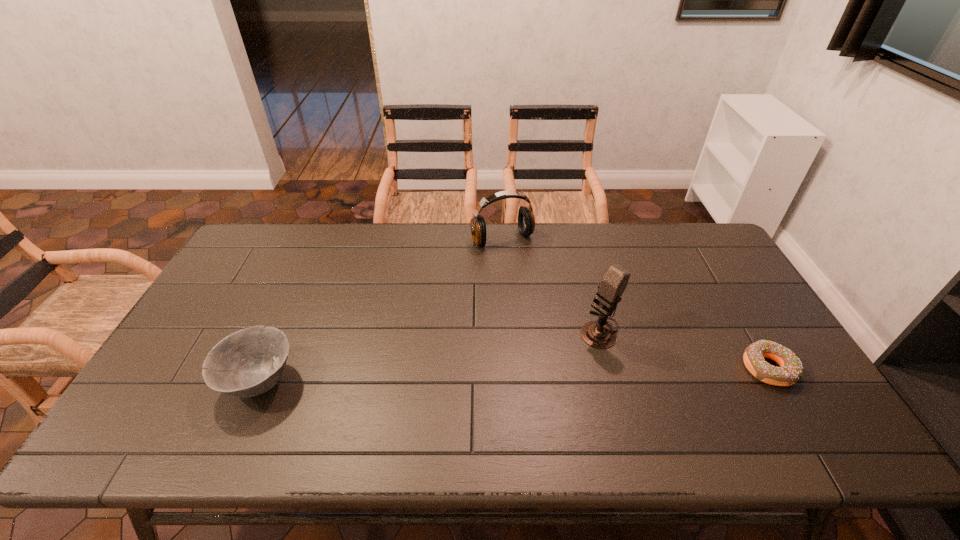
What are the coordinates of `free space in the image that satisfies the following two spatial constraints: 1. on the back side of the second shortest object; 2. on the right side of the microphone` in the screenshot? It's located at (282, 329).